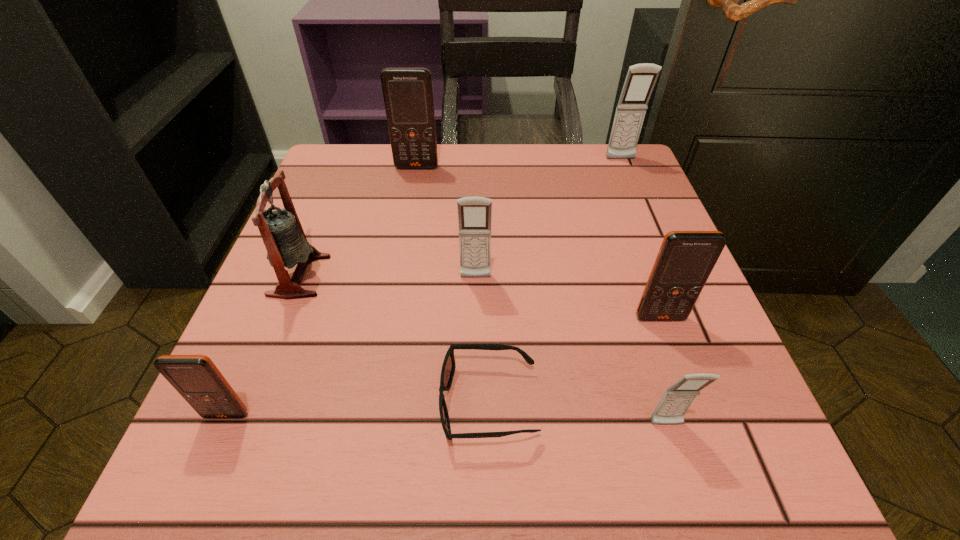
Identify the location of the nearest orange cellular telephone. (196, 378).

Where is `the second gray cellular telephone from right to left`? The height and width of the screenshot is (540, 960). the second gray cellular telephone from right to left is located at coordinates click(677, 399).

At what (x,y) coordinates should I click in order to perform the action: click on the smallest gray cellular telephone. Please return your answer as a coordinate pair (x, y). This screenshot has height=540, width=960. Looking at the image, I should click on (677, 399).

Where is `the shortest object`? The height and width of the screenshot is (540, 960). the shortest object is located at coordinates (448, 368).

At what (x,y) coordinates should I click in order to perform the action: click on free point located 0.050m on the front-facing side of the rightmost gray cellular telephone. Please return your answer as a coordinate pair (x, y). The width and height of the screenshot is (960, 540). Looking at the image, I should click on (627, 174).

Where is `vacant area situated 0.280m on the screen of the biggest orange cellular telephone`? Image resolution: width=960 pixels, height=540 pixels. vacant area situated 0.280m on the screen of the biggest orange cellular telephone is located at coordinates (401, 254).

Locate an element on the screen. free space located 0.110m on the back of the bell is located at coordinates (324, 214).

You are a GUI agent. You are given a task and a screenshot of the screen. Output one action in this format:
    pyautogui.click(x=<x>, y=<y>)
    Task: Click on the free space located 0.310m on the front-facing side of the third cellular telephone from left to right
    This screenshot has height=540, width=960.
    Given the screenshot: What is the action you would take?
    pyautogui.click(x=473, y=462)

In order to click on vacant point located 0.190m on the screen of the rightmost orange cellular telephone in this screenshot , I will do (x=704, y=438).

Where is `vacant area located 0.050m on the screen of the nearest orange cellular telephone`? vacant area located 0.050m on the screen of the nearest orange cellular telephone is located at coordinates (208, 457).